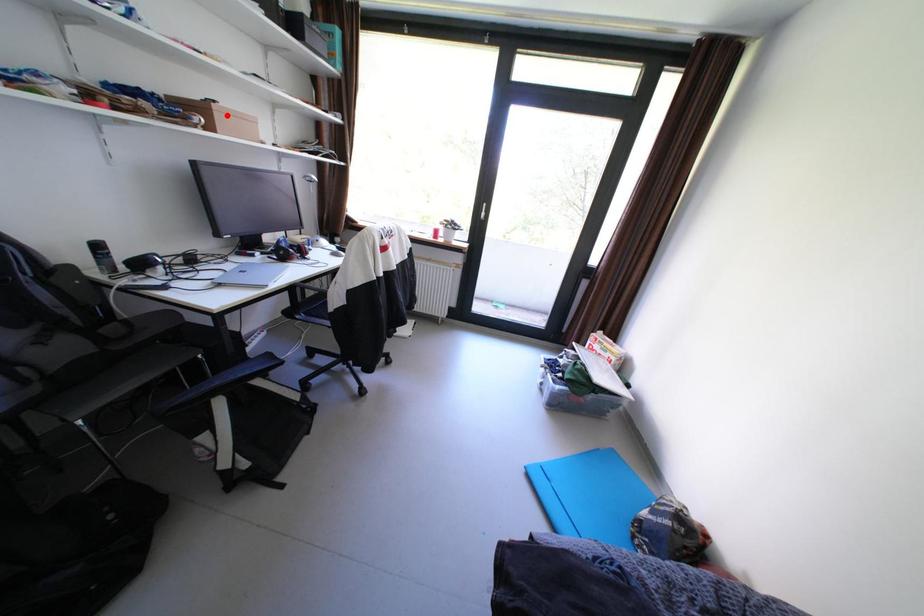
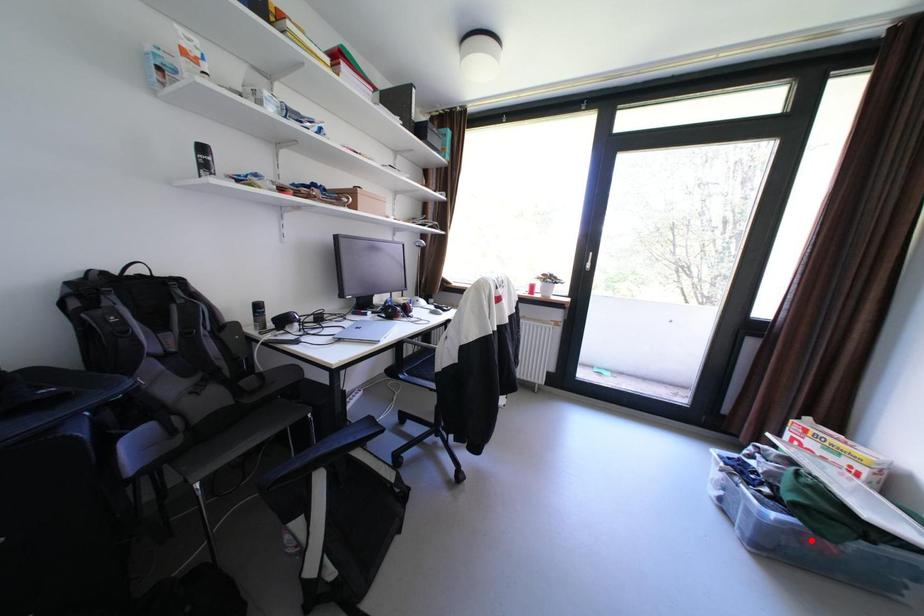
I am providing you with two images of the same scene from different viewpoints. A red point is marked on the first image and another point is marked on the second image. Are the points marked in image1 and image2 representing the same 3D position?

No